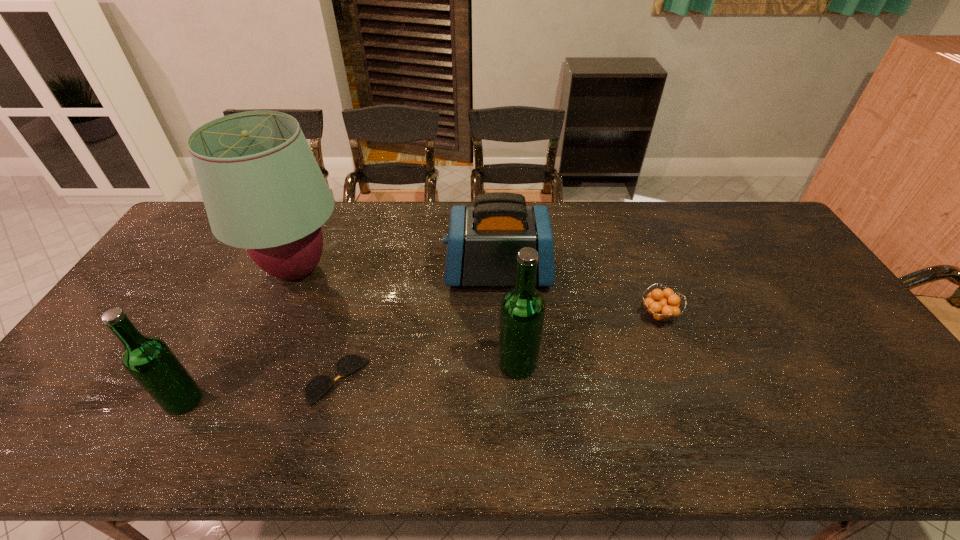
Find the location of a particular element. blank area in the image that satisfies the following two spatial constraints: 1. on the front side of the tallest object; 2. on the right side of the spectacles is located at coordinates (x=249, y=380).

Identify the location of free space that satisfies the following two spatial constraints: 1. on the front-facing side of the toaster; 2. on the front side of the shorter beer bottle. (504, 401).

Image resolution: width=960 pixels, height=540 pixels. I want to click on free space that satisfies the following two spatial constraints: 1. on the front side of the tallest object; 2. on the left side of the fifth tallest object, so point(277,315).

This screenshot has width=960, height=540. In order to click on vacant point that satisfies the following two spatial constraints: 1. on the back side of the shorter beer bottle; 2. on the left side of the lampshade in this screenshot , I will do `click(254, 270)`.